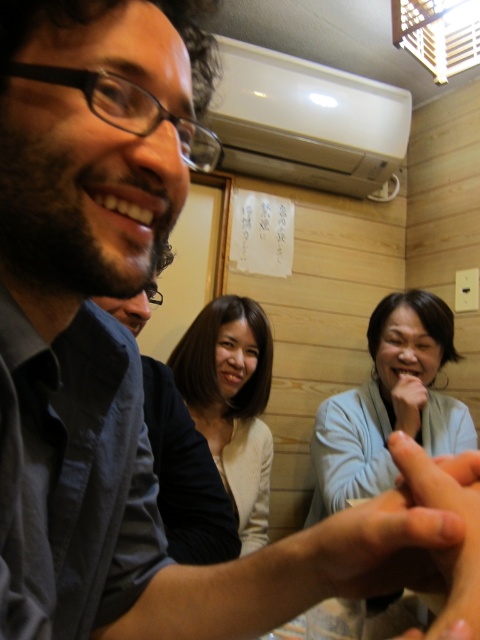
Is light blue fabric at center closer to camera compared to smooth skin hand at center?

No, light blue fabric at center is behind smooth skin hand at center.

This screenshot has width=480, height=640. I want to click on light blue fabric at center, so click(x=388, y=403).

Can you confirm if light blue fabric at center is positioned to the left of smooth beige blouse at center?

No, light blue fabric at center is not to the left of smooth beige blouse at center.

Image resolution: width=480 pixels, height=640 pixels. What do you see at coordinates (388, 403) in the screenshot? I see `light blue fabric at center` at bounding box center [388, 403].

I want to click on light blue fabric at center, so click(x=388, y=403).

Can you confirm if smooth beige blouse at center is smaller than smooth skin hand at center?

No, smooth beige blouse at center is not smaller than smooth skin hand at center.

What do you see at coordinates (231, 401) in the screenshot? I see `smooth beige blouse at center` at bounding box center [231, 401].

Find the location of a particular element. This screenshot has height=640, width=480. smooth beige blouse at center is located at coordinates (231, 401).